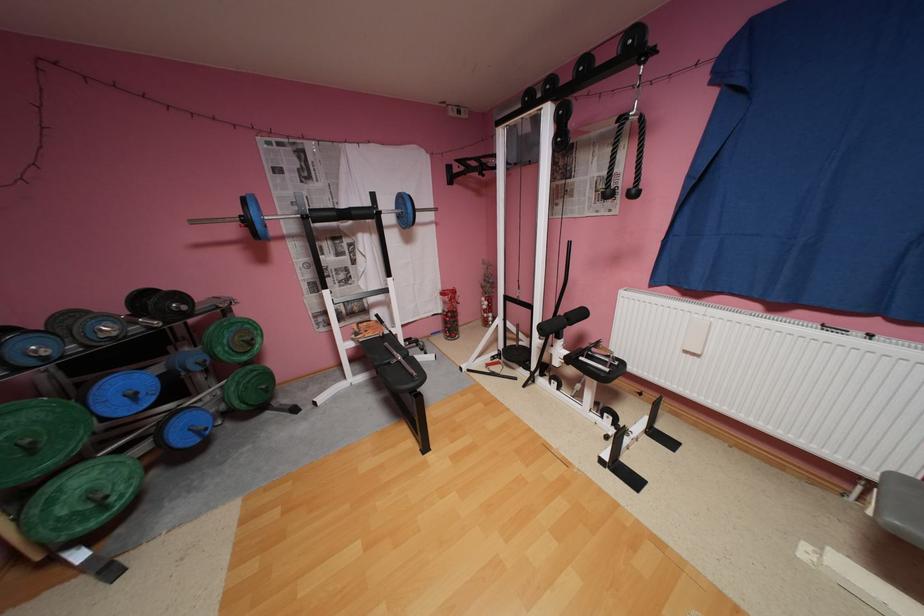
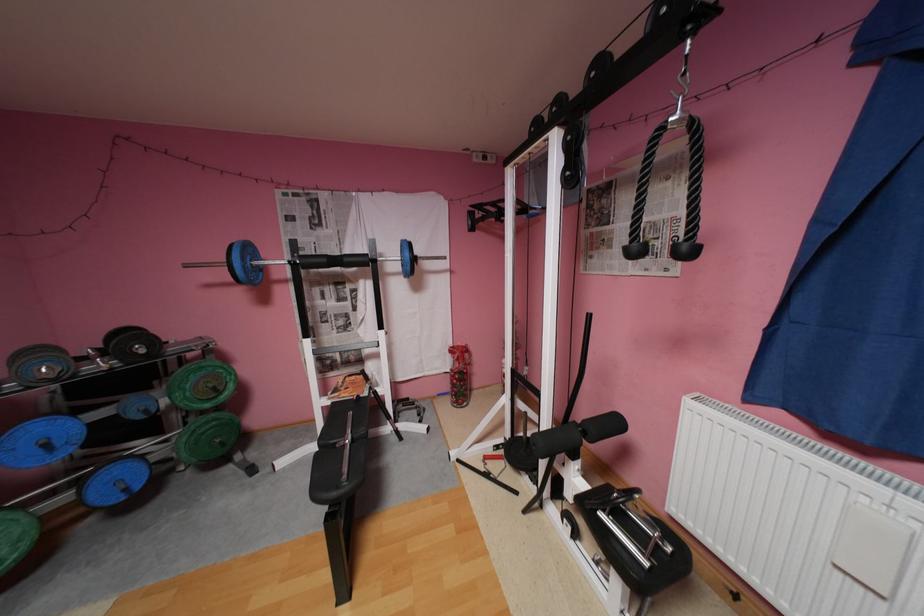
Find the pixel in the second image that matches (142,395) in the first image.

(55, 445)